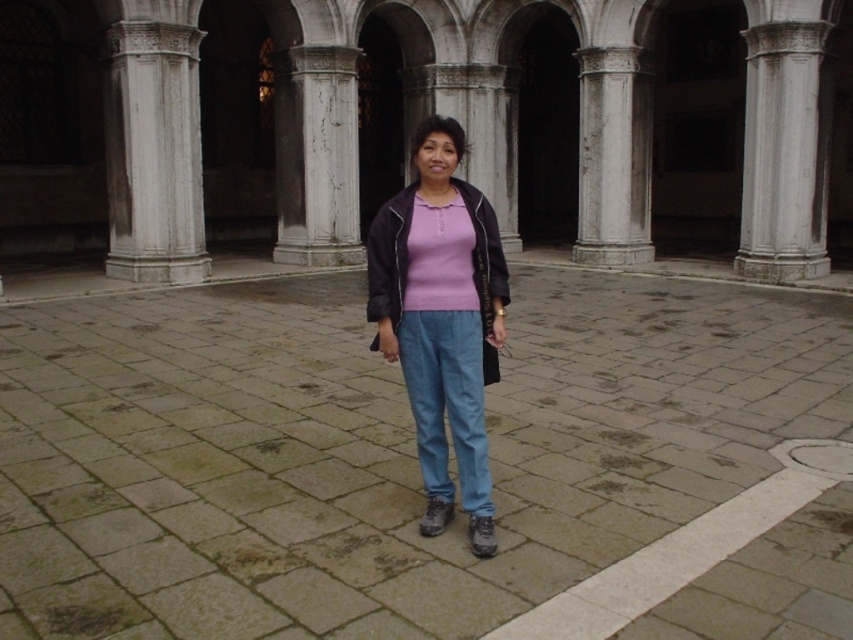
Question: Can you confirm if white marble column at center is smaller than matte black jacket at center?

Choices:
 (A) no
 (B) yes

Answer: (B)

Question: Which of the following is the farthest from the observer?

Choices:
 (A) (624, 243)
 (B) (196, 208)
 (C) (473, 216)

Answer: (A)

Question: Which object is the closest to the matte pink shirt at center?

Choices:
 (A) white stone column at center
 (B) white stone column at left
 (C) matte black jacket at center
 (D) white marble column at center

Answer: (C)

Question: Does matte pink shirt at center have a greater width compared to white stone column at center?

Choices:
 (A) yes
 (B) no

Answer: (B)

Question: Does white stone column at center have a smaller size compared to white marble column at center?

Choices:
 (A) no
 (B) yes

Answer: (B)

Question: Which point is closer to the camera?

Choices:
 (A) white marble column at center
 (B) white stone column at left
 (C) matte pink shirt at center
 (D) matte black jacket at center

Answer: (C)